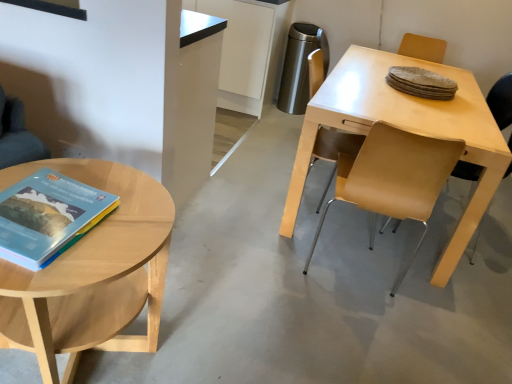
Identify the location of vacant space to the right of light brown leather chair at right, positioned as the 2th chair in left-to-right order. This screenshot has height=384, width=512. (496, 240).